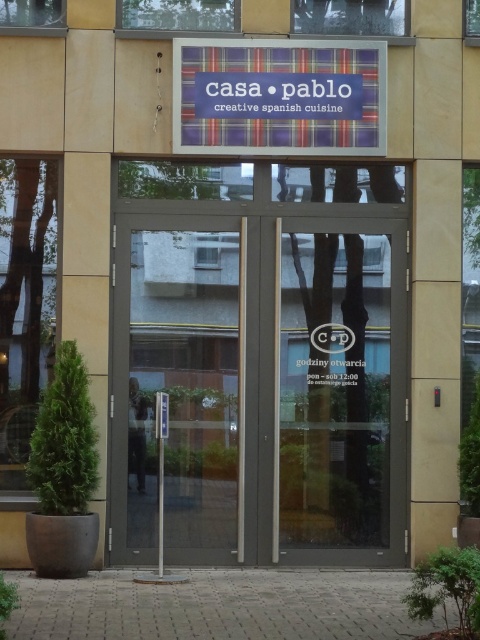
Is matte gray glass door at center below silver metallic pole at center?

No, matte gray glass door at center is not below silver metallic pole at center.

Can you confirm if matte gray glass door at center is wider than silver metallic pole at center?

Yes.

Is point (264, 356) positioned behind point (163, 547)?

Yes, point (264, 356) is behind point (163, 547).

Identify the location of matte gray glass door at center. (260, 388).

Is matte gray glass door at center to the left of matte gray door at center from the viewer's perspective?

Incorrect, matte gray glass door at center is not on the left side of matte gray door at center.

Is point (208, 337) positioned before point (222, 444)?

No.

Who is more distant from viewer, (345, 432) or (129, 540)?

Point (345, 432)

The width and height of the screenshot is (480, 640). I want to click on matte gray glass door at center, so click(x=260, y=388).

Does matte gray glass door at center lie in front of plaid fabric sign at center?

No, matte gray glass door at center is behind plaid fabric sign at center.

Between matte gray glass door at center and plaid fabric sign at center, which one appears on the left side from the viewer's perspective?

matte gray glass door at center

Between point (149, 445) and point (204, 60), which one is positioned in front?

Positioned in front is point (204, 60).

At what (x,y) coordinates should I click in order to perform the action: click on matte gray glass door at center. Please return your answer as a coordinate pair (x, y). Image resolution: width=480 pixels, height=640 pixels. Looking at the image, I should click on (260, 388).